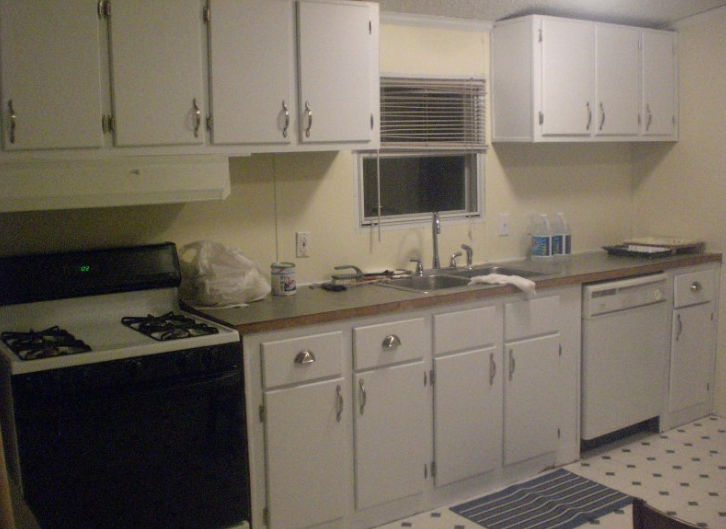
The width and height of the screenshot is (726, 529). Find the location of `floor`. floor is located at coordinates (684, 470).